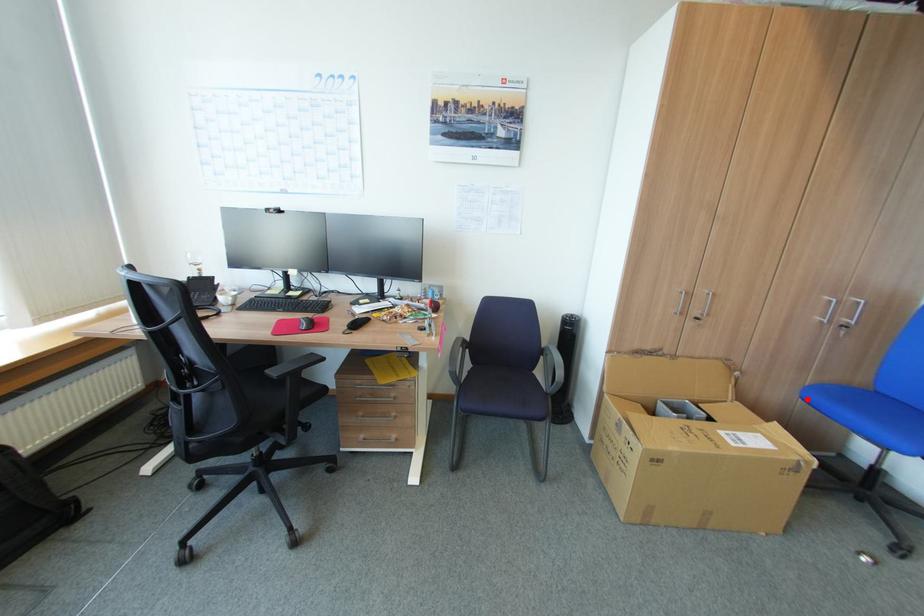
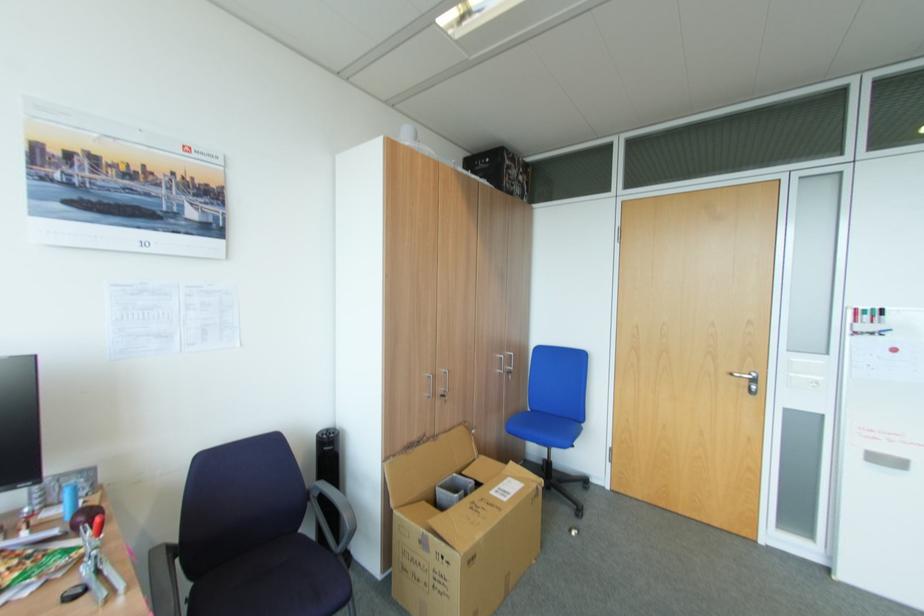
Locate, in the second image, the point that corresponds to the highlighted location in the first image.

(515, 431)